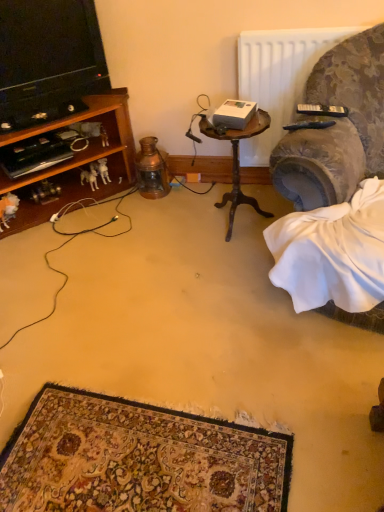
Question: From the image's perspective, is white plastic dog at lower left over white fabric at lower right?

Choices:
 (A) yes
 (B) no

Answer: (A)

Question: From a real-world perspective, is white plastic dog at lower left on top of white fabric at lower right?

Choices:
 (A) yes
 (B) no

Answer: (B)

Question: Are white plastic dog at lower left and white fabric at lower right located far from each other?

Choices:
 (A) no
 (B) yes

Answer: (B)

Question: Considering the relative sizes of white plastic dog at lower left and white fabric at lower right in the image provided, is white plastic dog at lower left bigger than white fabric at lower right?

Choices:
 (A) no
 (B) yes

Answer: (A)

Question: Is white plastic dog at lower left to the right of white fabric at lower right from the viewer's perspective?

Choices:
 (A) yes
 (B) no

Answer: (B)

Question: Looking at their shapes, would you say black plastic remote control at upper right, the 2th remote control positioned from the bottom, is wider or thinner than white fabric at lower right?

Choices:
 (A) thin
 (B) wide

Answer: (A)

Question: Which is correct: black plastic remote control at upper right, acting as the first remote control starting from the top, is inside white fabric at lower right, or outside of it?

Choices:
 (A) outside
 (B) inside

Answer: (A)

Question: Is point (339, 113) positioned closer to the camera than point (327, 275)?

Choices:
 (A) farther
 (B) closer

Answer: (A)

Question: From their relative heights in the image, would you say black plastic remote control at upper right, acting as the first remote control starting from the top, is taller or shorter than white fabric at lower right?

Choices:
 (A) short
 (B) tall

Answer: (A)

Question: Is black plastic remote control at upper right, which ranks as the 2th remote control in top-to-bottom order, taller or shorter than black plastic remote control at upper right, the 2th remote control positioned from the bottom?

Choices:
 (A) short
 (B) tall

Answer: (A)

Question: In terms of size, does black plastic remote control at upper right, the 2th remote control when ordered from back to front, appear bigger or smaller than black plastic remote control at upper right, acting as the first remote control starting from the top?

Choices:
 (A) small
 (B) big

Answer: (A)

Question: From a real-world perspective, is black plastic remote control at upper right, the 2th remote control when ordered from back to front, positioned above or below black plastic remote control at upper right, the 2th remote control positioned from the bottom?

Choices:
 (A) below
 (B) above

Answer: (A)

Question: Does point (297, 128) appear closer or farther from the camera than point (332, 105)?

Choices:
 (A) closer
 (B) farther

Answer: (A)

Question: Considering their positions, is black cable at left located in front of or behind velvet fabric couch at right?

Choices:
 (A) front
 (B) behind

Answer: (A)

Question: Considering the positions of black cable at left and velvet fabric couch at right in the image, is black cable at left wider or thinner than velvet fabric couch at right?

Choices:
 (A) thin
 (B) wide

Answer: (B)